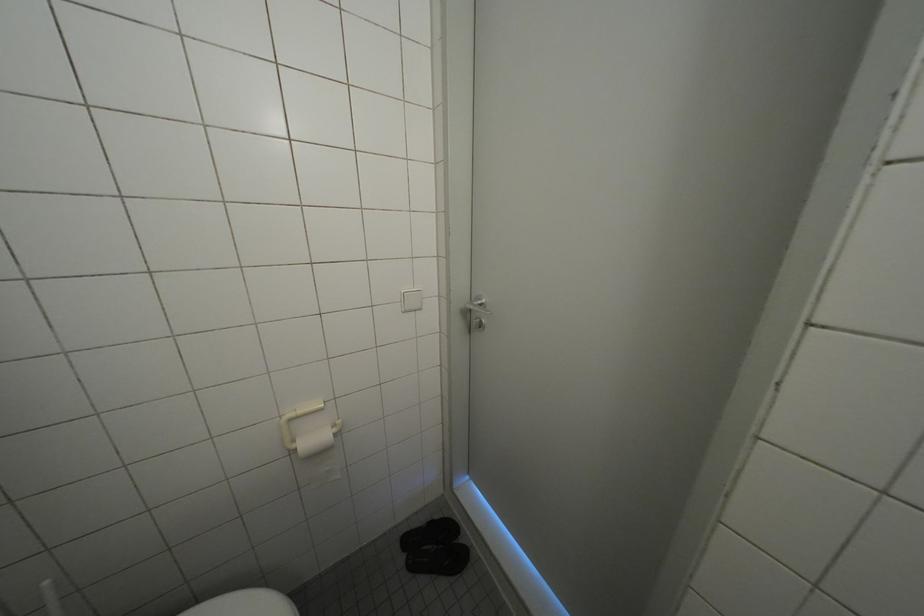
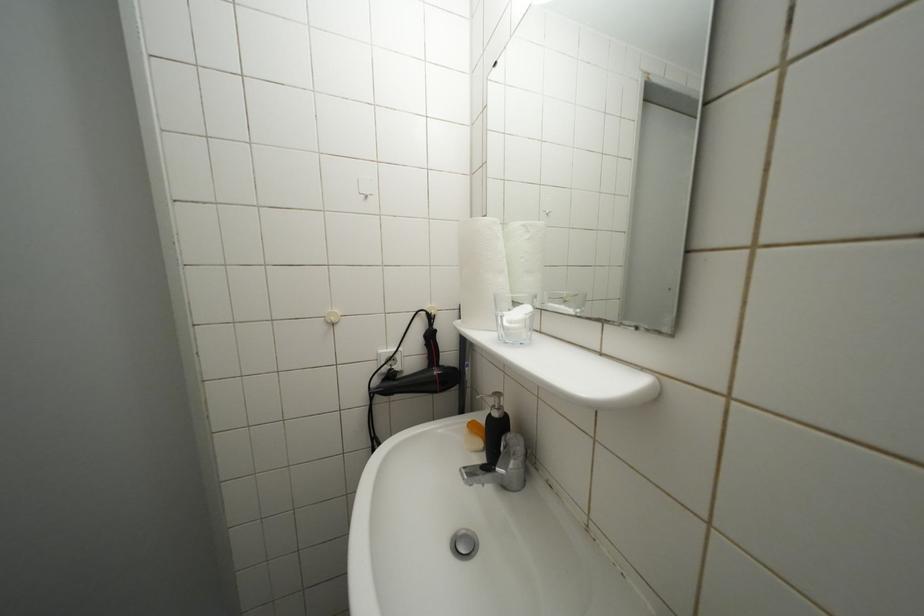
Question: Based on the continuous images, in which direction is the camera rotating? Reply with the corresponding letter.

Choices:
 (A) Left
 (B) Right
 (C) Up
 (D) Down

Answer: (B)